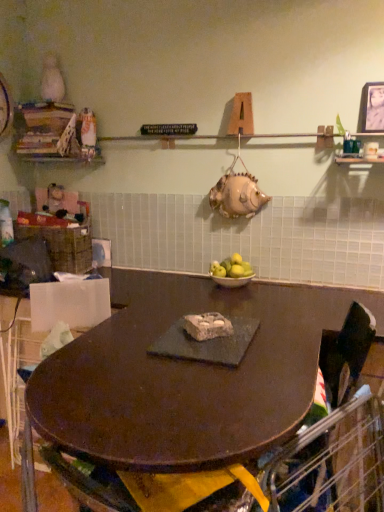
This screenshot has height=512, width=384. Find the location of `free spot above dark brown wood table at center (from a real-world perspective)`. free spot above dark brown wood table at center (from a real-world perspective) is located at coordinates pyautogui.click(x=168, y=367).